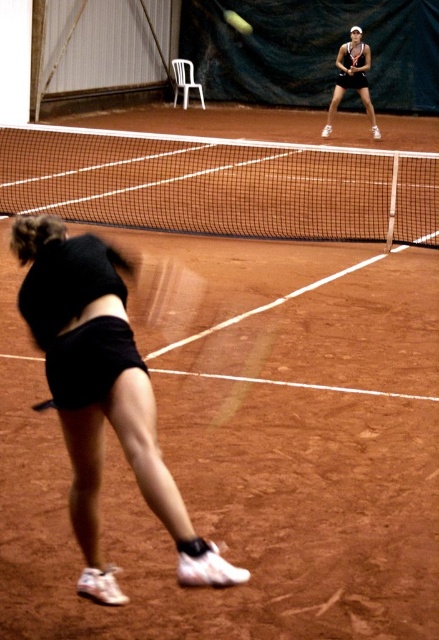
You are a photographer positioned at the baseline of the clay court. You want to take a photo that includes both the black matte shorts at lower left and the matte black tennis racket at upper center. Which object will appear larger in your photo?

The black matte shorts at lower left will appear larger in the photo because it is closer to the viewer than the matte black tennis racket at upper center.

You are a photographer trying to capture the player in motion. You notice the black matte shorts at lower left and the matte black tennis racket at upper center. Which object should you focus on if you want to photograph the smaller one?

The black matte shorts at lower left has a smaller size compared to the matte black tennis racket at upper center, so you should focus on the black matte shorts at lower left to photograph the smaller one.

You are a tennis player standing at the baseline of the clay court. You see two points marked on the court, point 1 at coordinates point (32, 330) and point 2 at coordinates point (349, 48). Which point is closer to your current position?

Point 1 at coordinates point (32, 330) is closer to your current position because it is in front of point 2 at coordinates point (349, 48).